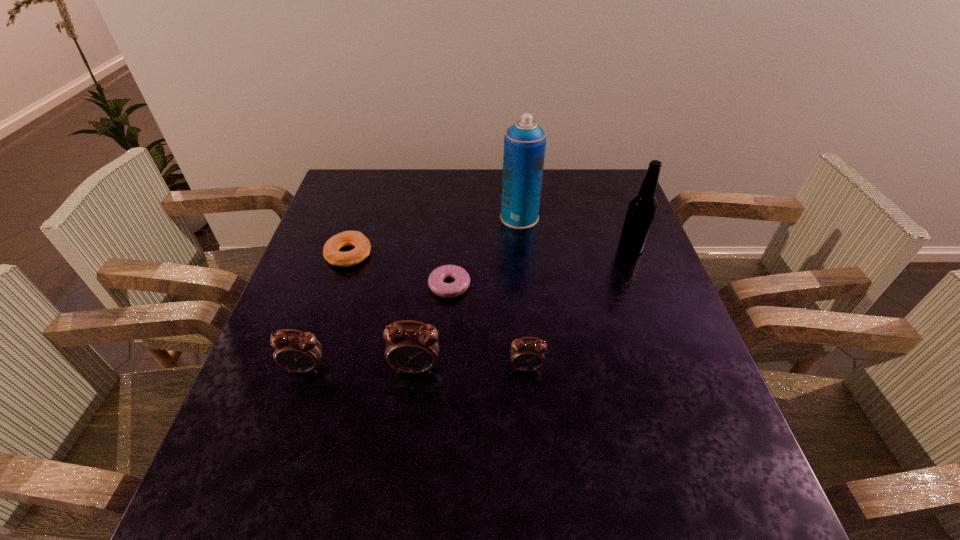
Identify the location of free point that keeps the alarm clocks evenly spaced on the right. The image size is (960, 540). (636, 367).